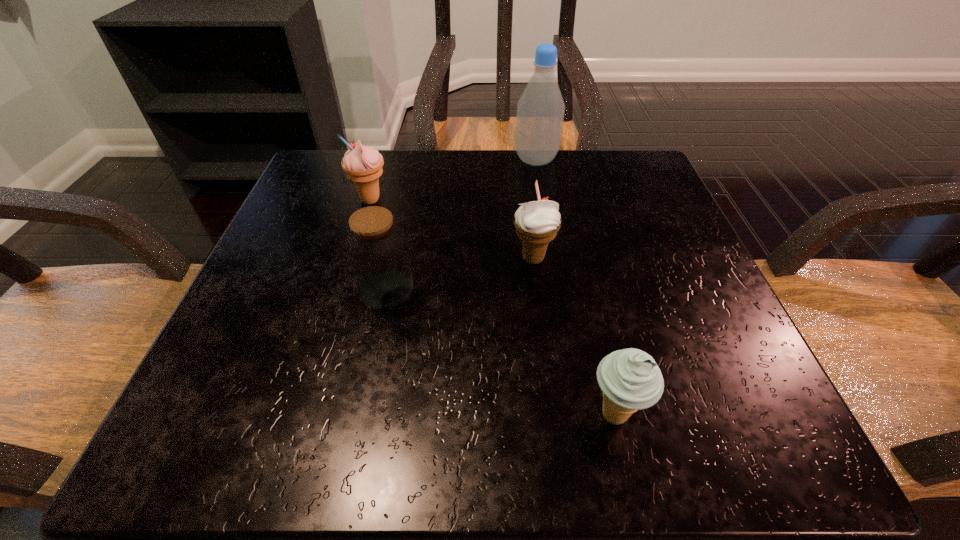
Image resolution: width=960 pixels, height=540 pixels. Find the location of `free spot located on the front of the jar`. free spot located on the front of the jar is located at coordinates (372, 354).

Where is `free space located 0.300m on the front of the second icecream from left to right`? free space located 0.300m on the front of the second icecream from left to right is located at coordinates (558, 454).

Where is `free space located 0.130m on the left of the nearest icecream`? The height and width of the screenshot is (540, 960). free space located 0.130m on the left of the nearest icecream is located at coordinates (482, 415).

Identify the location of bottle located at the far edge. (540, 110).

In order to click on icecream that is positioned at the far edge in this screenshot , I will do `click(363, 165)`.

Locate an element on the screen. The height and width of the screenshot is (540, 960). object that is at the near edge is located at coordinates (630, 379).

You are a GUI agent. You are given a task and a screenshot of the screen. Output one action in this format:
    pyautogui.click(x=<x>, y=<y>)
    Task: Click on the object present at the left edge
    This screenshot has width=960, height=540.
    Given the screenshot: What is the action you would take?
    pyautogui.click(x=363, y=165)

You are a GUI agent. You are given a task and a screenshot of the screen. Output one action in this format:
    pyautogui.click(x=<x>, y=<y>)
    Task: Click on the object present at the far left corner
    The image size is (960, 540).
    Given the screenshot: What is the action you would take?
    pyautogui.click(x=363, y=165)

Locate an element on the screen. This screenshot has height=540, width=960. free location at the far edge is located at coordinates (463, 191).

The image size is (960, 540). Identify the location of vacant space at the near edge of the desktop. (552, 454).